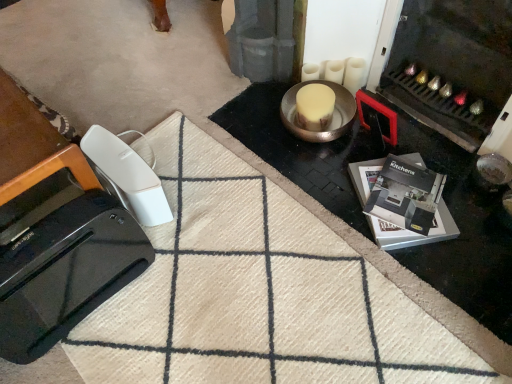
At what (x,y) coordinates should I click in order to perform the action: click on free point above black glossy toaster at lower left, the 1th home appliance from the front (from a real-world perspective). Please return your answer as a coordinate pair (x, y). This screenshot has height=384, width=512. Looking at the image, I should click on (33, 240).